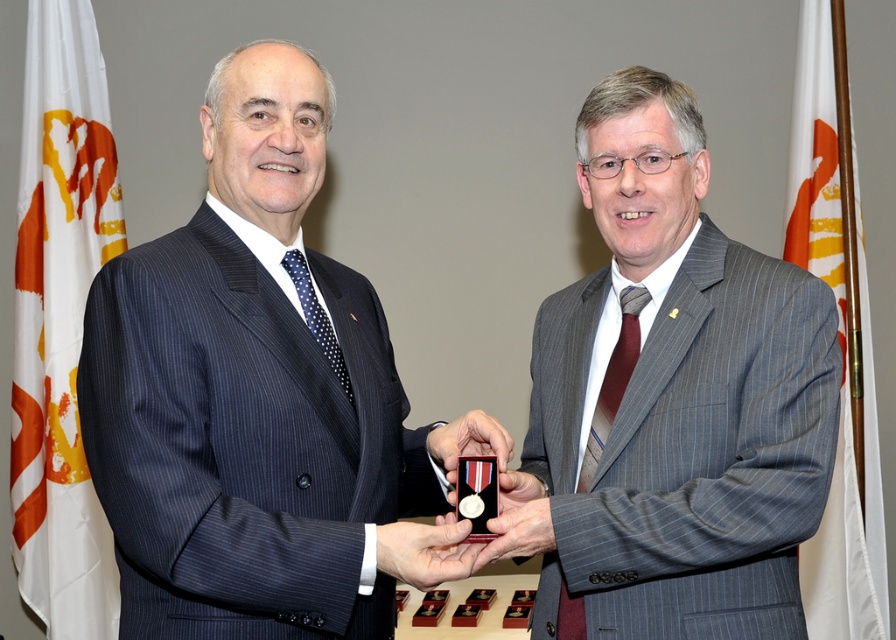
You are a photographer positioned behind the two men. You need to capture a photo where both the dark blue pinstripe suit at center and the gray pinstripe suit at center are in frame. Given that your camera has a maximum focus range of 15 inches, will you be able to focus on both subjects simultaneously?

The distance between the dark blue pinstripe suit at center and the gray pinstripe suit at center is 15.67 inches, which exceeds the camera maximum focus range of 15 inches. Therefore, the photographer cannot focus on both subjects simultaneously.

You are standing at the point marked by the coordinates point (x=134, y=250). You want to move to the door located 1.5 meters away from your current position. Can you reach the door without moving more than 1.38 meters?

The point (x=134, y=250) is 1.38 meters away from the viewer. Since the door is 1.5 meters away from your current position, you would need to move 1.5 meters, which exceeds the 1.38 meters limit. Therefore, you cannot reach the door without moving more than 1.38 meters.